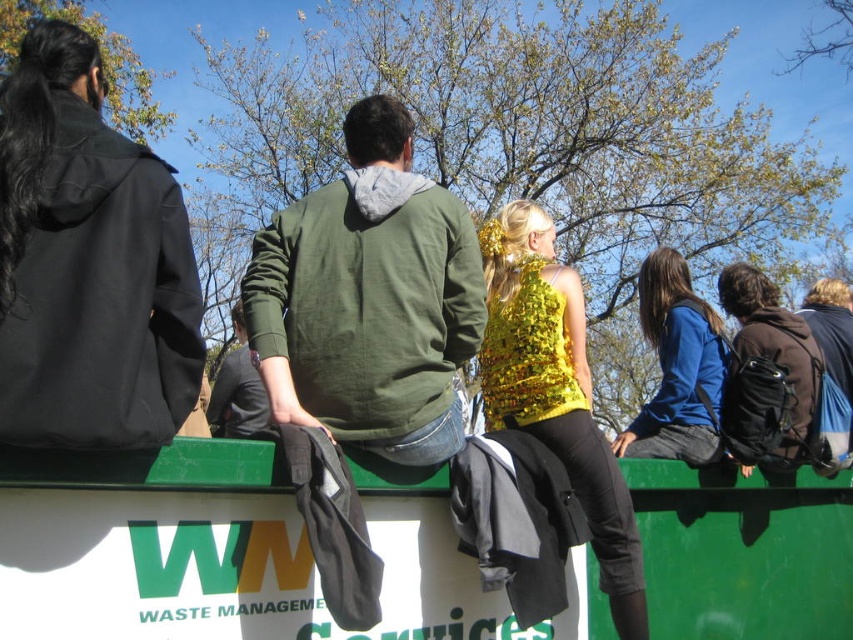
Question: Is gold sequined top at center to the right of blue fabric jacket at center from the viewer's perspective?

Choices:
 (A) yes
 (B) no

Answer: (B)

Question: Which point is closer to the camera taking this photo?

Choices:
 (A) (706, 308)
 (B) (498, 419)

Answer: (B)

Question: Is gold sequined top at center closer to camera compared to blue fabric jacket at center?

Choices:
 (A) no
 (B) yes

Answer: (B)

Question: In this image, where is gold sequined top at center located relative to blue fabric jacket at center?

Choices:
 (A) below
 (B) above

Answer: (A)